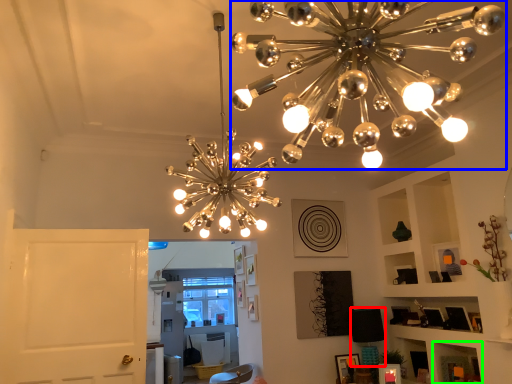
Question: Which object is the farthest from lamp (highlighted by a red box)? Choose among these: lamp (highlighted by a blue box) or shelf (highlighted by a green box).

Choices:
 (A) lamp
 (B) shelf

Answer: (A)